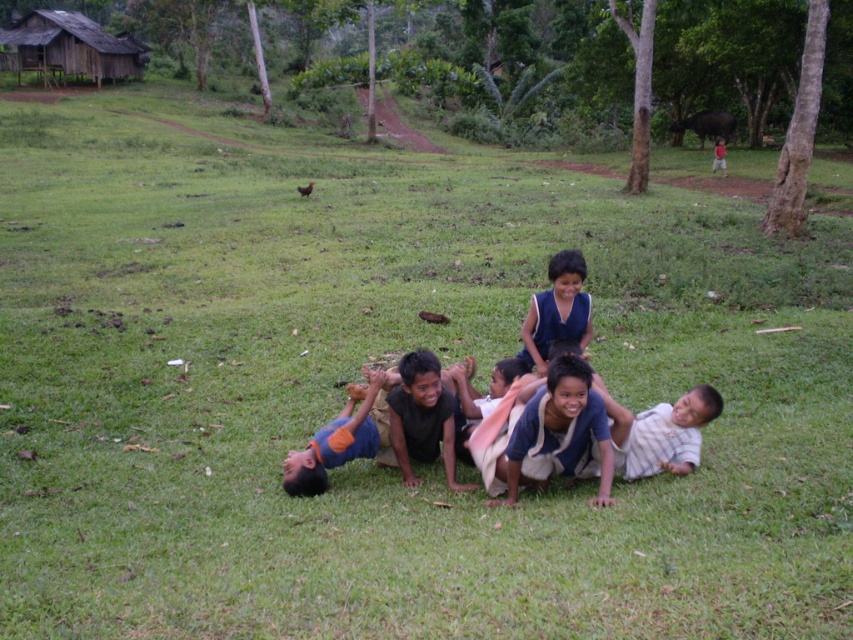
The height and width of the screenshot is (640, 853). In order to click on brown wooden hut at upper left in this screenshot , I will do `click(73, 45)`.

Describe the element at coordinates (73, 45) in the screenshot. Image resolution: width=853 pixels, height=640 pixels. I see `brown wooden hut at upper left` at that location.

Who is more forward, (65,10) or (718,148)?

Point (718,148)

This screenshot has height=640, width=853. What are the coordinates of `brown wooden hut at upper left` in the screenshot? It's located at tap(73, 45).

Does brown wooden hut at upper left have a larger size compared to blue fabric shirt at center?

Yes, brown wooden hut at upper left is bigger than blue fabric shirt at center.

Locate an element on the screen. This screenshot has width=853, height=640. brown wooden hut at upper left is located at coordinates (73, 45).

What do you see at coordinates (73, 45) in the screenshot? I see `brown wooden hut at upper left` at bounding box center [73, 45].

At what (x,y) coordinates should I click in order to perform the action: click on brown wooden hut at upper left. Please return your answer as a coordinate pair (x, y). The width and height of the screenshot is (853, 640). Looking at the image, I should click on (73, 45).

In the scene shown: Which of these two, dark blue shirt at lower center or red cotton shirt at upper right, stands shorter?

With less height is dark blue shirt at lower center.

Is dark blue shirt at lower center in front of red cotton shirt at upper right?

Yes, it is.

Measure the distance between point (x=405, y=410) and camera.

They are 6.26 meters apart.

Identify the location of dark blue shirt at lower center. (381, 428).